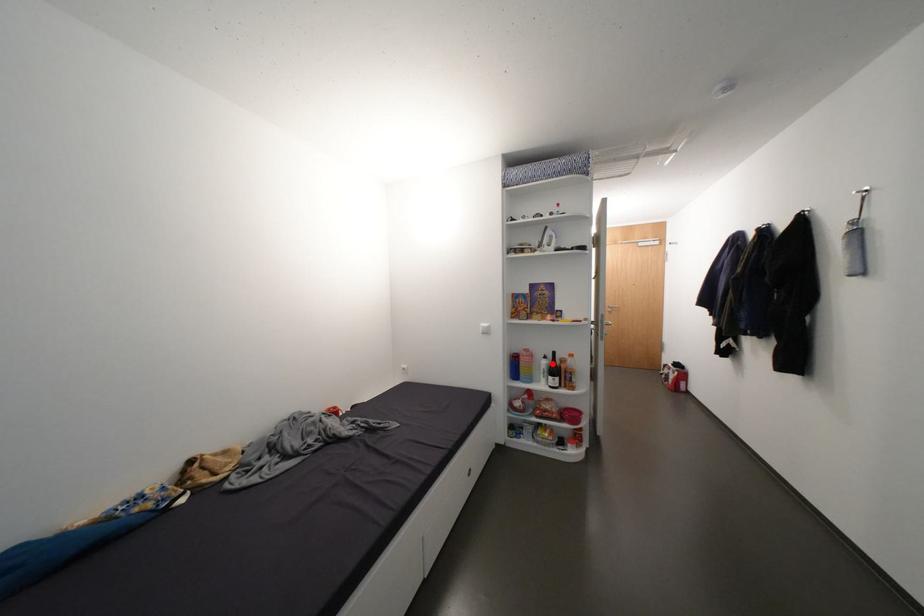
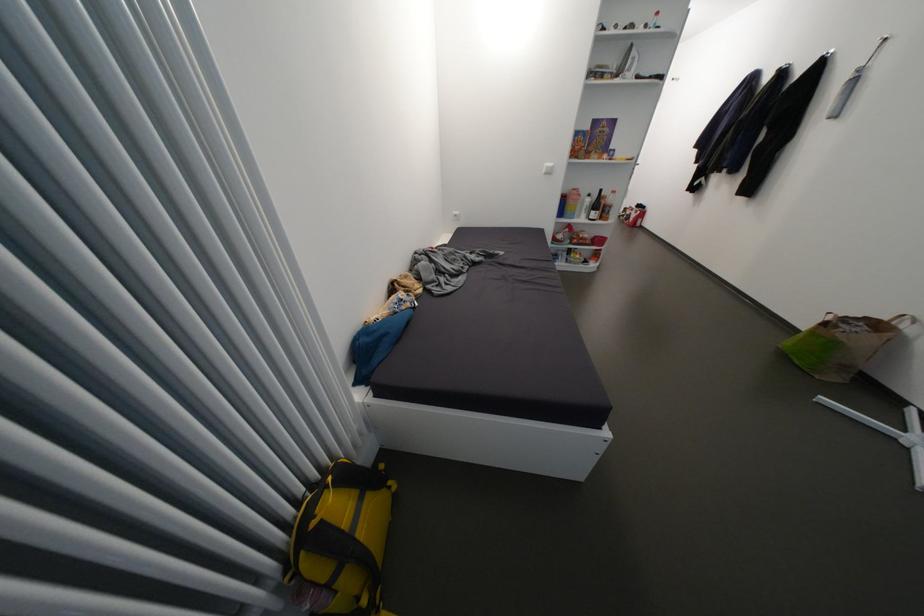
Find the pixel in the second image that matches the highlighted location in the first image.

(596, 201)